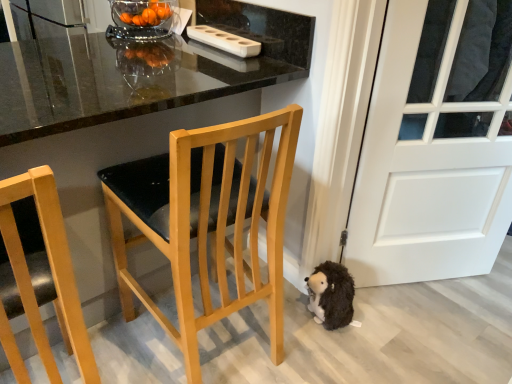
Question: From the image's perspective, would you say light wood chair at center, the first chair in the right-to-left sequence, is shown under light wood chair at left, which appears as the 2th chair when viewed from the right?

Choices:
 (A) no
 (B) yes

Answer: (A)

Question: Does light wood chair at center, placed as the second chair when sorted from left to right, come behind light wood chair at left, marked as the first chair in a left-to-right arrangement?

Choices:
 (A) no
 (B) yes

Answer: (B)

Question: Is light wood chair at center, placed as the second chair when sorted from left to right, oriented towards light wood chair at left, which appears as the 2th chair when viewed from the right?

Choices:
 (A) yes
 (B) no

Answer: (B)

Question: From a real-world perspective, is light wood chair at center, placed as the second chair when sorted from left to right, positioned over light wood chair at left, which appears as the 2th chair when viewed from the right, based on gravity?

Choices:
 (A) yes
 (B) no

Answer: (A)

Question: From a real-world perspective, is light wood chair at center, placed as the second chair when sorted from left to right, physically below light wood chair at left, which appears as the 2th chair when viewed from the right?

Choices:
 (A) no
 (B) yes

Answer: (A)

Question: Is light wood chair at center, the first chair in the right-to-left sequence, smaller than light wood chair at left, marked as the first chair in a left-to-right arrangement?

Choices:
 (A) no
 (B) yes

Answer: (A)

Question: Is white matte door at lower right oriented towards glossy black table at center?

Choices:
 (A) no
 (B) yes

Answer: (A)

Question: From the image's perspective, is white matte door at lower right located above glossy black table at center?

Choices:
 (A) no
 (B) yes

Answer: (A)

Question: Considering the relative sizes of white matte door at lower right and glossy black table at center in the image provided, is white matte door at lower right bigger than glossy black table at center?

Choices:
 (A) no
 (B) yes

Answer: (A)

Question: Is white matte door at lower right smaller than glossy black table at center?

Choices:
 (A) yes
 (B) no

Answer: (A)

Question: Does white matte door at lower right lie behind glossy black table at center?

Choices:
 (A) no
 (B) yes

Answer: (B)

Question: Would you say glossy black table at center is part of white matte door at lower right's contents?

Choices:
 (A) yes
 (B) no

Answer: (B)

Question: Would you say white matte door at lower right contains transparent glass bowl at upper center?

Choices:
 (A) yes
 (B) no

Answer: (B)